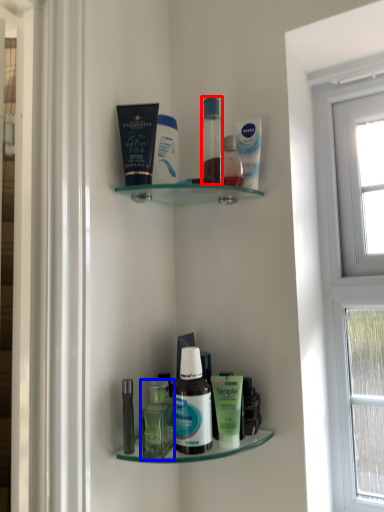
Question: Which object is closer to the camera taking this photo, toiletry (highlighted by a red box) or bottle (highlighted by a blue box)?

Choices:
 (A) toiletry
 (B) bottle

Answer: (B)